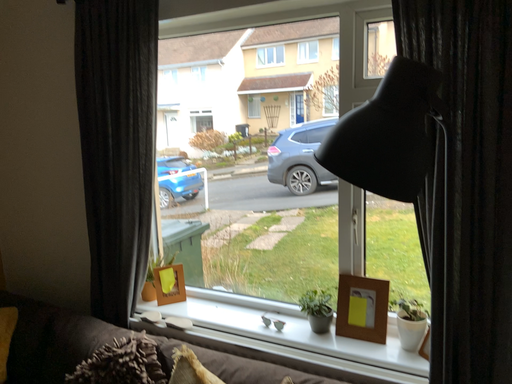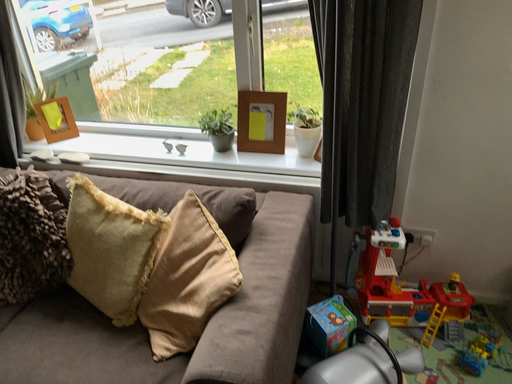
Question: How did the camera likely rotate when shooting the video?

Choices:
 (A) rotated right
 (B) rotated left

Answer: (A)